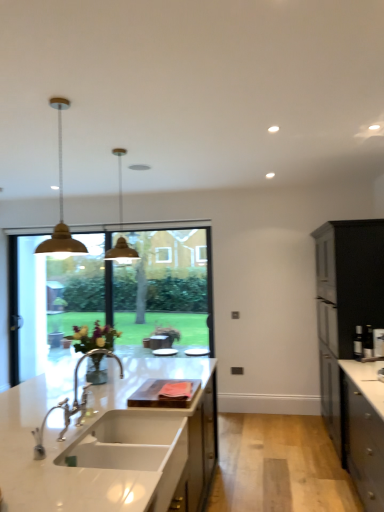
Where is `free space above gold matte pendant light at upper left (from a real-world perspective)`? This screenshot has height=512, width=384. free space above gold matte pendant light at upper left (from a real-world perspective) is located at coordinates (55, 102).